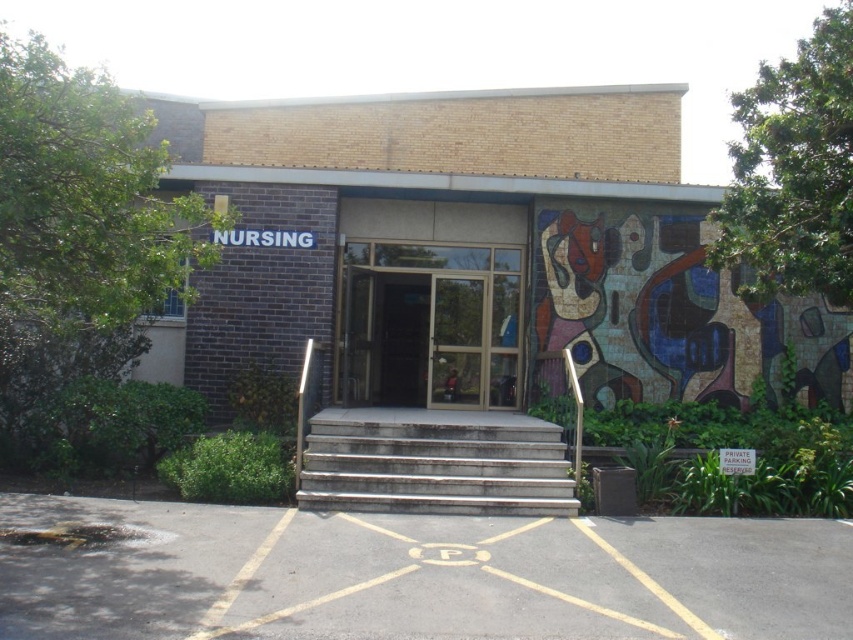
Can you confirm if transparent glass door at center is positioned below gray concrete stairs at center?

No, transparent glass door at center is not below gray concrete stairs at center.

Does transparent glass door at center appear on the left side of gray concrete stairs at center?

Correct, you'll find transparent glass door at center to the left of gray concrete stairs at center.

The height and width of the screenshot is (640, 853). I want to click on transparent glass door at center, so click(428, 324).